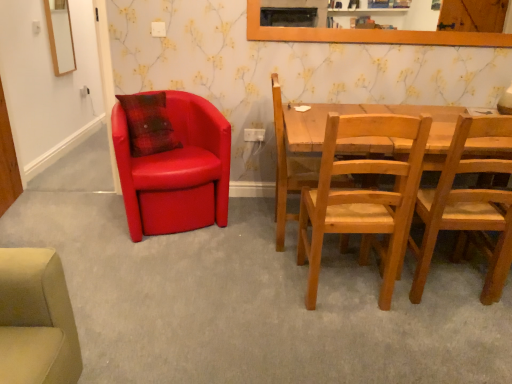
Locate an element on the screen. free space in front of wooden chair at center, arranged as the 2th chair when viewed from the left is located at coordinates (279, 266).